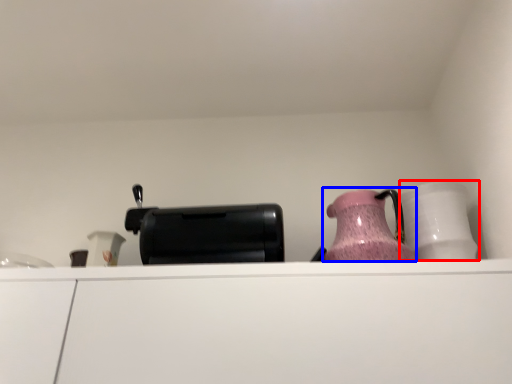
Question: Among these objects, which one is nearest to the camera, tableware (highlighted by a red box) or jug (highlighted by a blue box)?

Choices:
 (A) tableware
 (B) jug

Answer: (B)